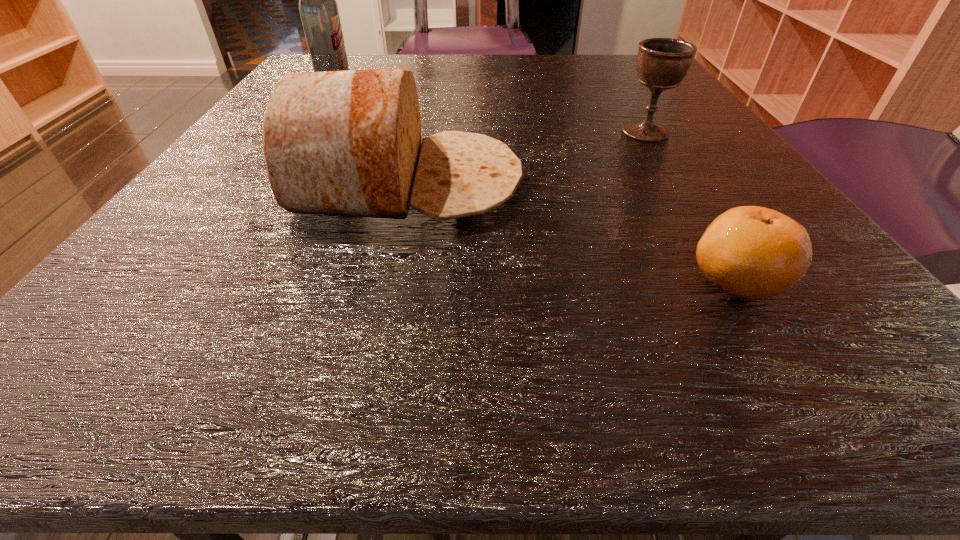
This screenshot has height=540, width=960. Find the location of `vacant point located 0.210m on the back of the nearest object`. vacant point located 0.210m on the back of the nearest object is located at coordinates (663, 162).

The height and width of the screenshot is (540, 960). What are the coordinates of `object that is at the far edge` in the screenshot? It's located at click(x=318, y=8).

I want to click on object present at the near edge, so click(753, 252).

You are a GUI agent. You are given a task and a screenshot of the screen. Output one action in this format:
    pyautogui.click(x=<x>, y=<y>)
    Task: Click on the vodka at the left edge
    
    Given the screenshot: What is the action you would take?
    pyautogui.click(x=318, y=8)

Locate an element on the screen. Image resolution: width=960 pixels, height=540 pixels. bread present at the left edge is located at coordinates (345, 143).

Identify the location of chalice that is at the right edge. (662, 63).

The width and height of the screenshot is (960, 540). What are the coordinates of `clementine that is at the right edge` in the screenshot? It's located at (753, 252).

The image size is (960, 540). In order to click on object located in the far left corner section of the desktop in this screenshot , I will do `click(318, 8)`.

This screenshot has height=540, width=960. I want to click on object that is at the near right corner, so click(753, 252).

This screenshot has width=960, height=540. I want to click on vacant space at the far edge of the desktop, so click(576, 55).